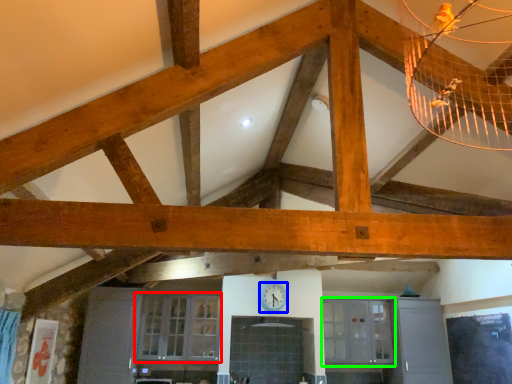
Question: Which object is positioned closest to window (highlighted by a red box)? Select from clock (highlighted by a blue box) and window (highlighted by a green box).

Choices:
 (A) clock
 (B) window

Answer: (A)